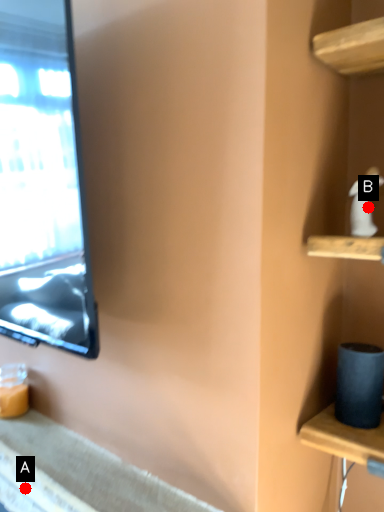
Question: Two points are circled on the image, labeled by A and B beside each circle. Which of the following is the farthest from the observer?

Choices:
 (A) A is further
 (B) B is further

Answer: (A)